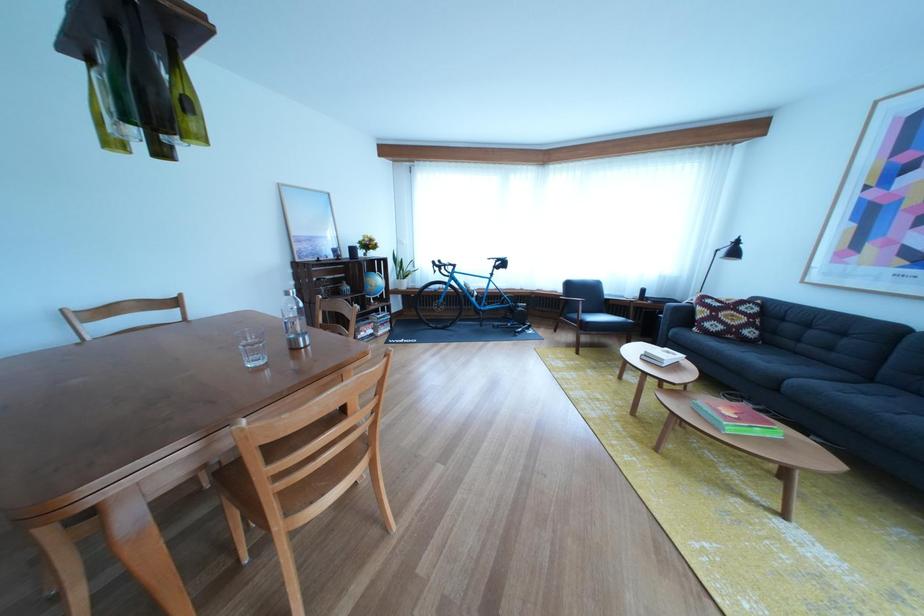
Where is `white plant pot`? white plant pot is located at coordinates (402, 270).